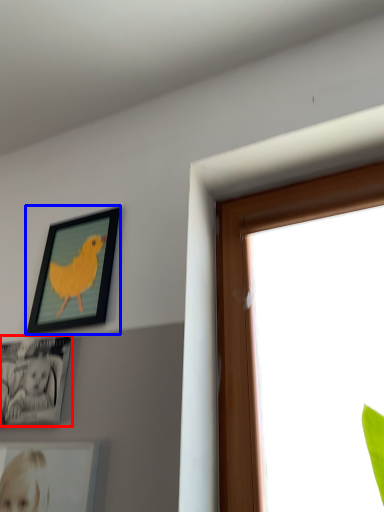
Question: Which of the following is the farthest to the observer, picture frame (highlighted by a red box) or picture frame (highlighted by a blue box)?

Choices:
 (A) picture frame
 (B) picture frame

Answer: (B)